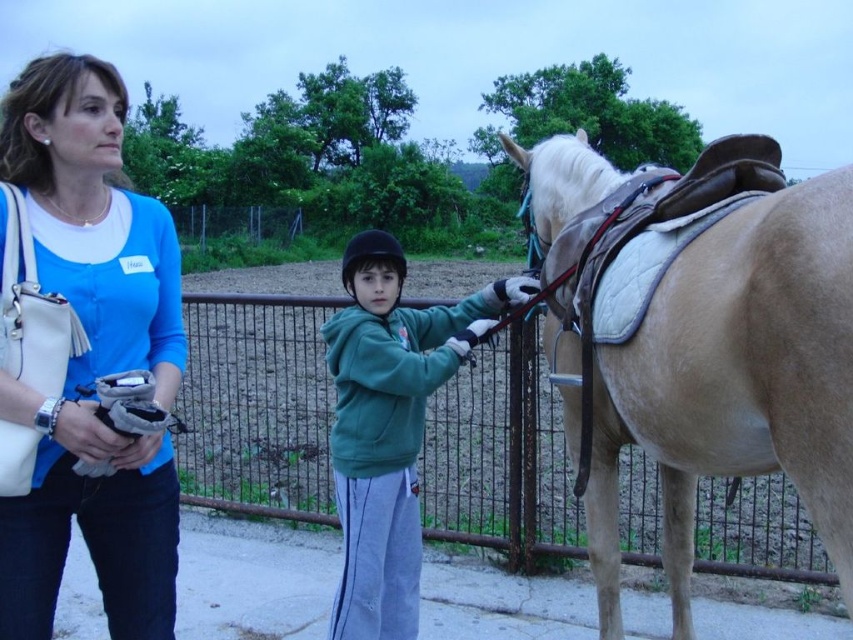
Question: Which point appears closest to the camera in this image?

Choices:
 (A) [x=83, y=113]
 (B) [x=845, y=448]

Answer: (B)

Question: Which point is farther to the camera?

Choices:
 (A) rusty metal fence at center
 (B) blue fabric shirt at upper left

Answer: (A)

Question: Is light brown leather saddle at right positioned behind blue fabric shirt at upper left?

Choices:
 (A) no
 (B) yes

Answer: (A)

Question: Is rusty metal fence at center positioned at the back of green fleece jacket at center?

Choices:
 (A) yes
 (B) no

Answer: (B)

Question: Can you confirm if rusty metal fence at center is positioned to the left of green fleece jacket at center?

Choices:
 (A) yes
 (B) no

Answer: (A)

Question: Which object appears farthest from the camera in this image?

Choices:
 (A) light brown leather saddle at right
 (B) blue fabric shirt at upper left
 (C) green fleece jacket at center

Answer: (C)